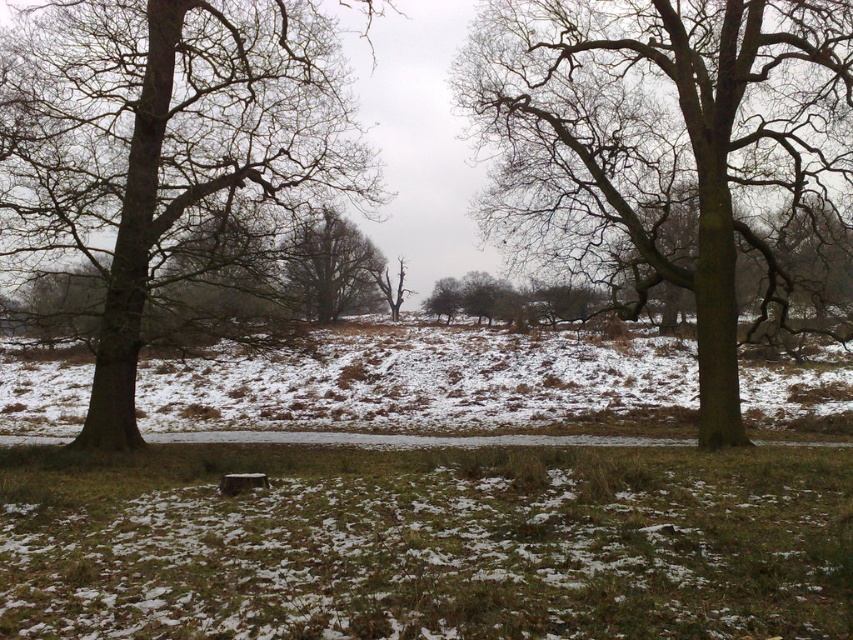
You are standing at the origin point in the winter landscape. You see a point at coordinate [184,490] and another at [194,147]. Which point is closer to you?

Point [184,490] is in front of point [194,147], so it is closer to you.

You are standing in the winter landscape described. You see a point marked at coordinates [659,138]. What does this point indicate?

The point at coordinates [659,138] indicates the location of the green rough bark tree at center.

You are standing in the winter landscape and want to walk towards the green grass at center. Which direction should you move relative to the brown rough bark tree at left?

Since the green grass at center is closer to the viewer than the brown rough bark tree at left, you should move towards the center area, which is in front of the brown rough bark tree at left.